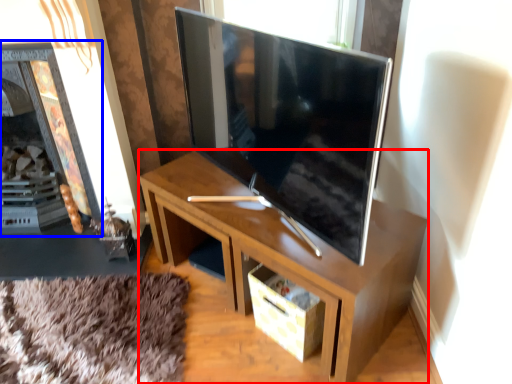
Question: Which point is further to the camera, desk (highlighted by a red box) or fireplace (highlighted by a blue box)?

Choices:
 (A) desk
 (B) fireplace

Answer: (B)